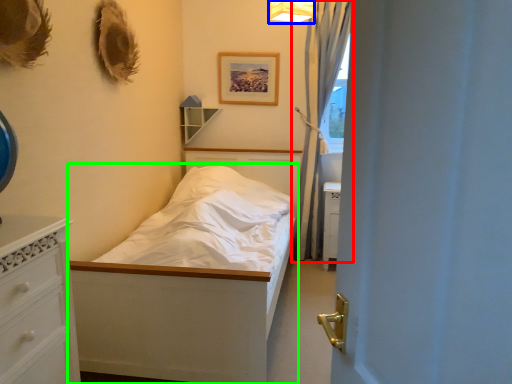
Question: Considering the real-world distances, which object is closest to curtain (highlighted by a red box)? light fixture (highlighted by a blue box) or bed (highlighted by a green box).

Choices:
 (A) light fixture
 (B) bed

Answer: (A)